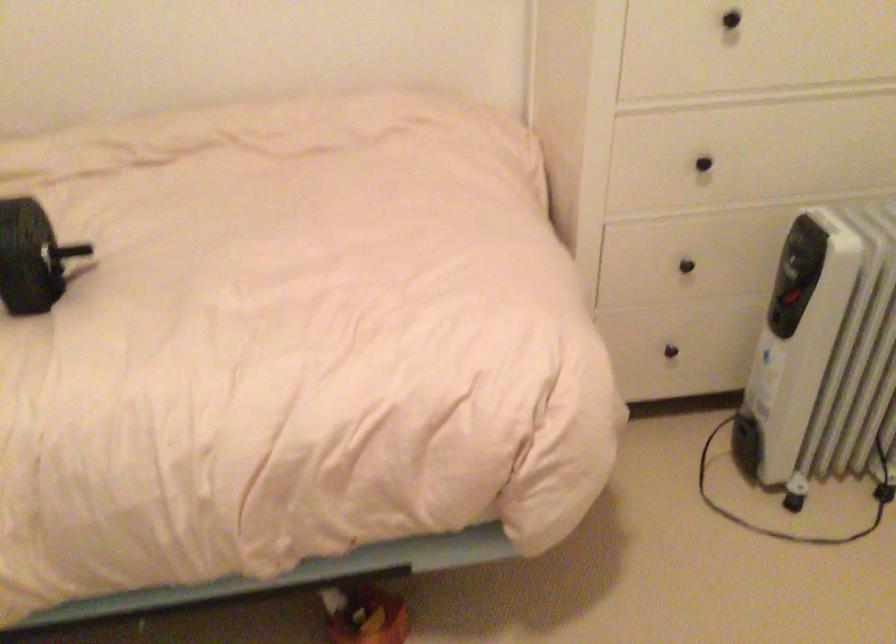
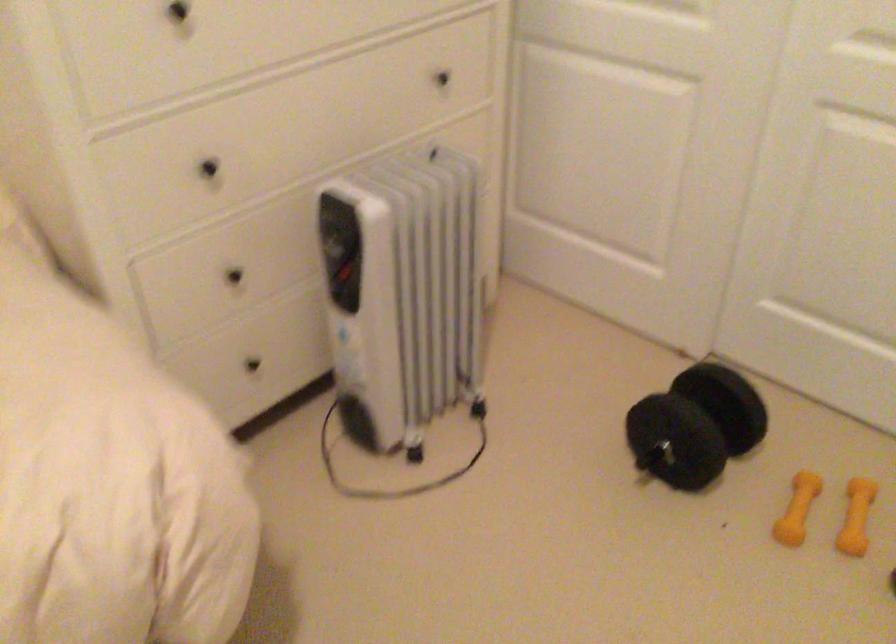
The point at (674,351) is marked in the first image. Where is the corresponding point in the second image?

(252, 364)